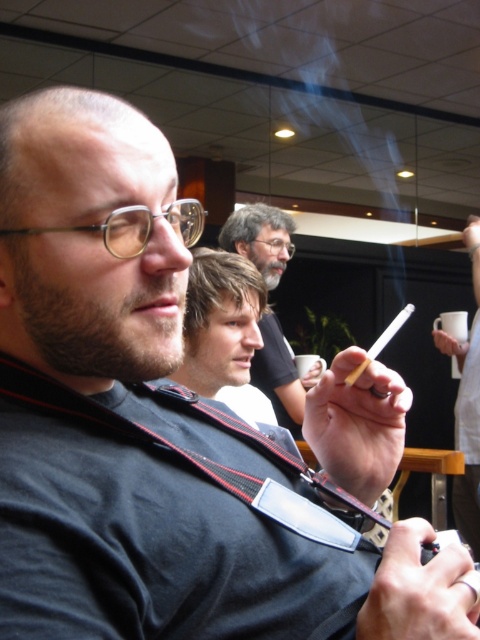
Question: In this image, where is matte black shirt at center located relative to white paper cigarette at center?

Choices:
 (A) right
 (B) left

Answer: (B)

Question: Which object is farther from the camera taking this photo?

Choices:
 (A) matte black shirt at center
 (B) smoketransparent at upper center
 (C) white paper cigarette at center
 (D) white matte cigarette at center

Answer: (B)

Question: Which of the following is the farthest from the observer?

Choices:
 (A) white paper cigarette at center
 (B) smoketransparent at upper center
 (C) matte black shirt at center

Answer: (B)

Question: Among these points, which one is nearest to the camera?

Choices:
 (A) (395, 330)
 (B) (295, 385)
 (C) (468, 227)
 (D) (320, 168)

Answer: (A)

Question: Can you confirm if smoketransparent at upper center is positioned above white matte cigarette at center?

Choices:
 (A) yes
 (B) no

Answer: (A)

Question: Can you confirm if white matte cigarette at center is bigger than white paper cigarette at center?

Choices:
 (A) no
 (B) yes

Answer: (B)